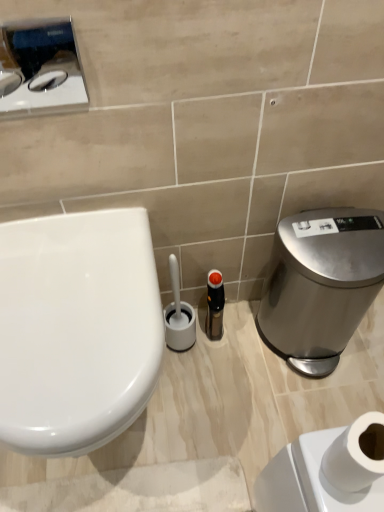
Where is `vacant space that's between black plastic bottle at center and satin silver trash can at right`? This screenshot has width=384, height=512. vacant space that's between black plastic bottle at center and satin silver trash can at right is located at coordinates (238, 344).